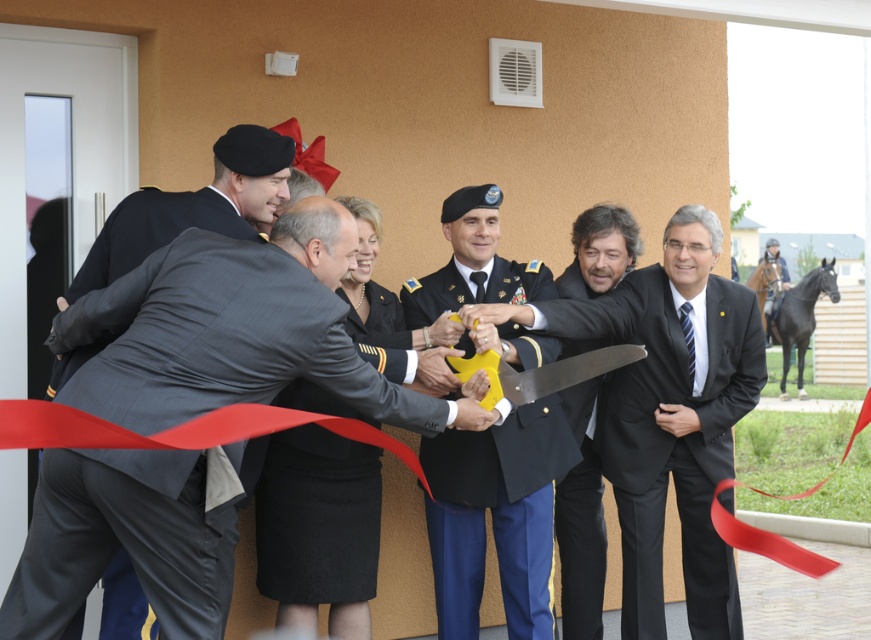
You are a photographer at the event and want to ensure both matte black suit at center and matte black suit at left are clearly visible in your photo. Which suit should you focus on to capture both without zooming in too much?

The matte black suit at center is bigger than the matte black suit at left, so focusing on the larger one will allow both to be visible without excessive zoom.